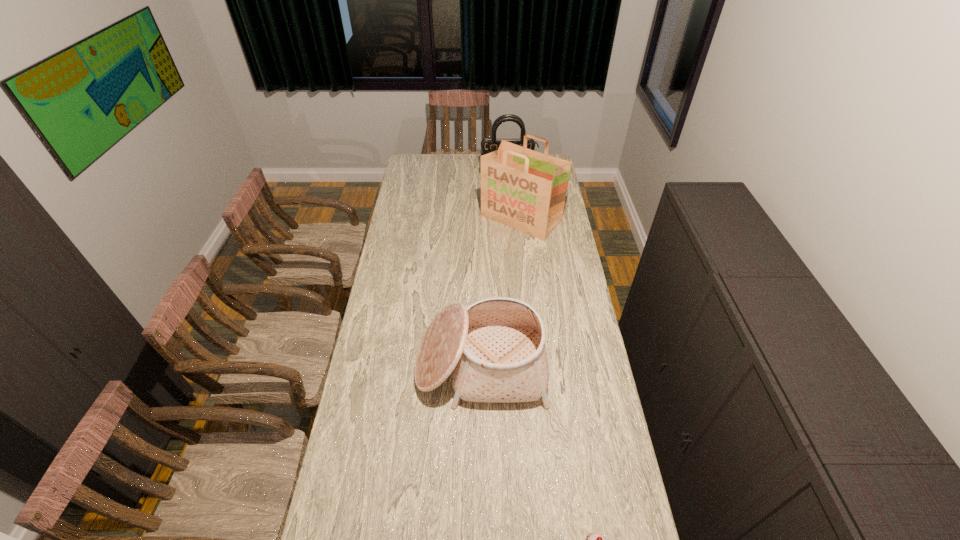
Point out which object is positioned as the second nearest to the shortest object. Please provide its 2D coordinates. Your answer should be formatted as a tuple, i.e. [(x, y)], where the tuple contains the x and y coordinates of a point satisfying the conditions above.

[(524, 189)]

At what (x,y) coordinates should I click in order to perform the action: click on free space that satisfies the following two spatial constraints: 1. with an open clasp on the front of the tallest object; 2. on the left side of the second tallest object. Please return your answer as a coordinate pair (x, y). The height and width of the screenshot is (540, 960). Looking at the image, I should click on (512, 218).